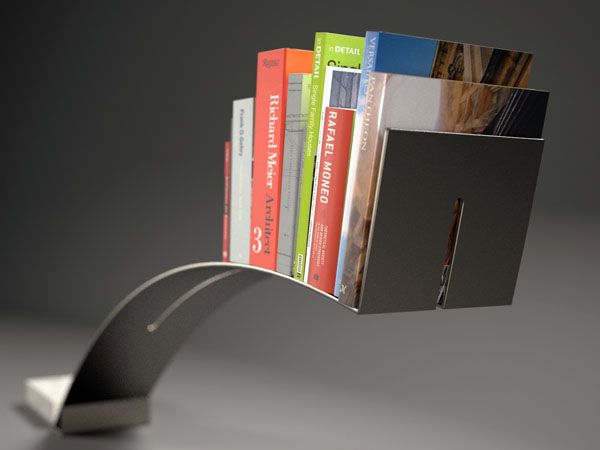
This screenshot has height=450, width=600. Find the location of `book shelf`. book shelf is located at coordinates (146, 371), (424, 252).